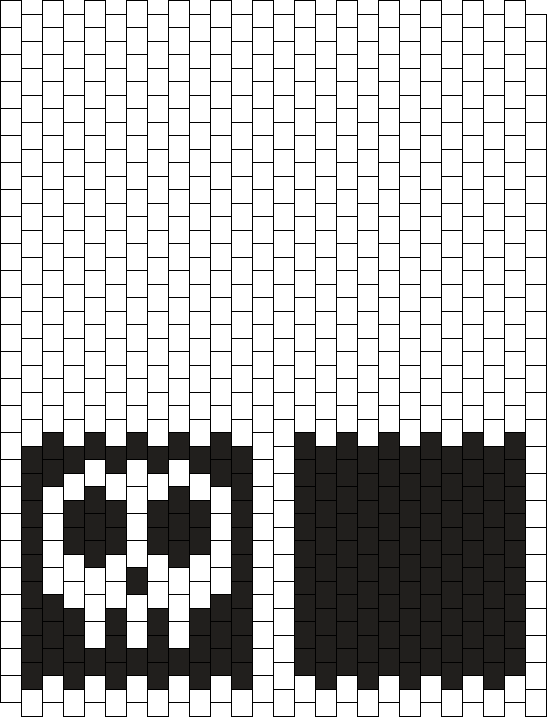
The width and height of the screenshot is (547, 717). I want to click on black tile square, so click(413, 546).